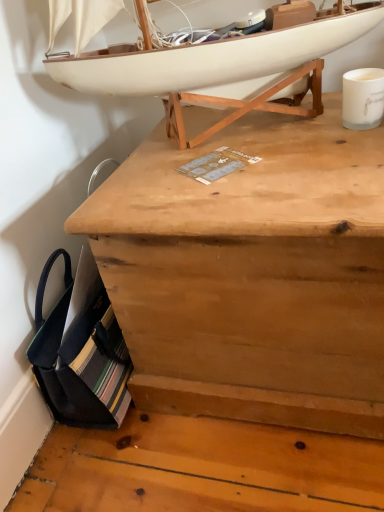
What are the coordinates of `free spot below white matte boat at upper center (from a real-world perspective)` in the screenshot? It's located at (255, 128).